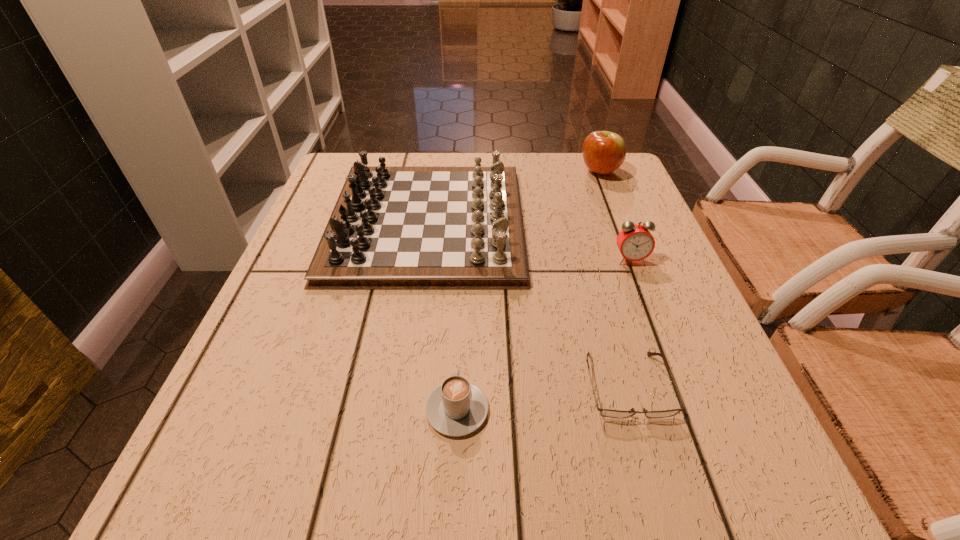
Where is `free spot that satisfies the following two spatial constraints: 1. to the right of the cappuccino; 2. from the player's perspective of the chessboard`? This screenshot has height=540, width=960. free spot that satisfies the following two spatial constraints: 1. to the right of the cappuccino; 2. from the player's perspective of the chessboard is located at coordinates (465, 222).